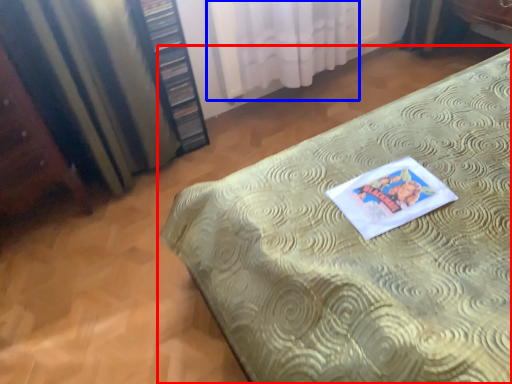
Question: Among these objects, which one is farthest to the camera, bed (highlighted by a red box) or curtain (highlighted by a blue box)?

Choices:
 (A) bed
 (B) curtain

Answer: (B)